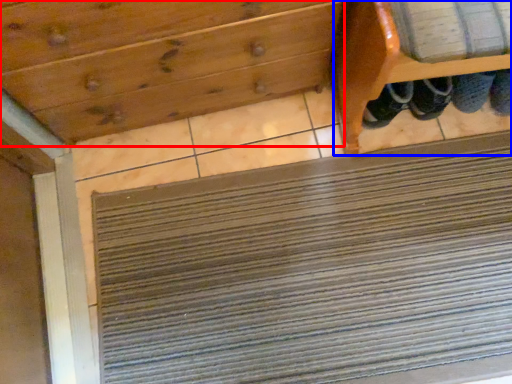
Question: Which of the following is the closest to the observer, drawer (highlighted by a red box) or furniture (highlighted by a blue box)?

Choices:
 (A) drawer
 (B) furniture

Answer: (B)